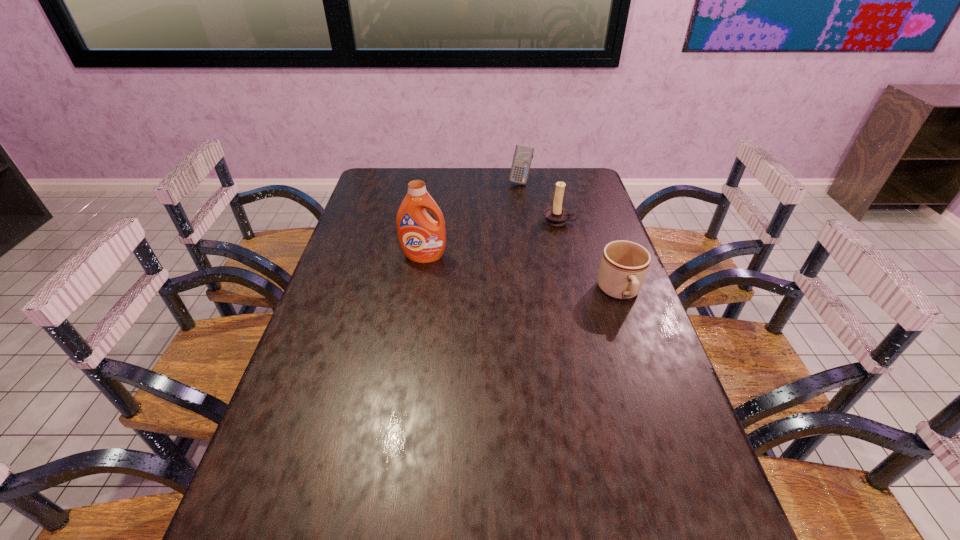
At what (x,y) coordinates should I click in order to perform the action: click on blank region between the third object from right to left and the shortest object. Please return your answer as a coordinate pair (x, y). The width and height of the screenshot is (960, 540). Looking at the image, I should click on (570, 237).

Where is `vacant space that is in between the leftmost object and the nearest object`? This screenshot has height=540, width=960. vacant space that is in between the leftmost object and the nearest object is located at coordinates (522, 275).

The height and width of the screenshot is (540, 960). In order to click on free point between the farthest object and the tallest object in this screenshot , I will do `click(472, 219)`.

The height and width of the screenshot is (540, 960). I want to click on free space between the second farthest object and the second object from left to right, so click(x=540, y=201).

You are a GUI agent. You are given a task and a screenshot of the screen. Output one action in this format:
    pyautogui.click(x=<x>, y=<y>)
    Task: Click on the closest object to the candle holder
    Image resolution: width=960 pixels, height=540 pixels.
    Given the screenshot: What is the action you would take?
    pyautogui.click(x=523, y=155)

Select which object appears as the second closest to the tallest object. Please provide its 2D coordinates. Your answer should be formatted as a tuple, i.e. [(x, y)], where the tuple contains the x and y coordinates of a point satisfying the conditions above.

[(624, 264)]